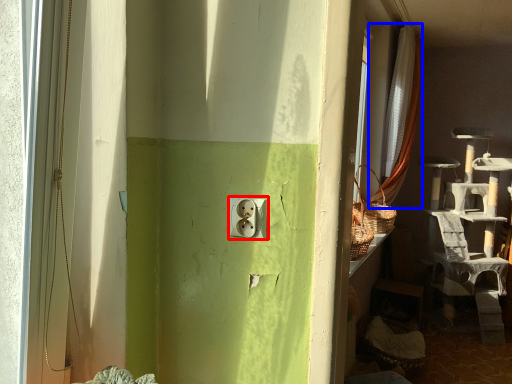
Question: Among these objects, which one is nearest to the camera, electric outlet (highlighted by a red box) or curtain (highlighted by a blue box)?

Choices:
 (A) electric outlet
 (B) curtain

Answer: (A)